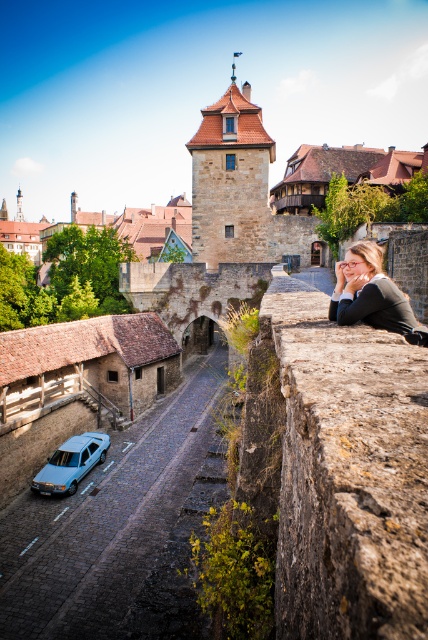
Question: Which object is farther from the camera taking this photo?

Choices:
 (A) matte black sweater at center
 (B) light blue matte sedan at lower left
 (C) rusty stone ledge at right

Answer: (B)

Question: Is rusty stone ledge at right to the left of light blue matte sedan at lower left from the viewer's perspective?

Choices:
 (A) no
 (B) yes

Answer: (A)

Question: Which point is closer to the camera?

Choices:
 (A) matte black sweater at center
 (B) rusty stone ledge at right
 (C) light blue matte sedan at lower left

Answer: (B)

Question: Among these points, which one is farthest from the camera?

Choices:
 (A) (336, 272)
 (B) (80, 444)
 (C) (285, 500)

Answer: (B)

Question: Does rusty stone ledge at right appear over light blue matte sedan at lower left?

Choices:
 (A) yes
 (B) no

Answer: (A)

Question: Is rusty stone ledge at right above matte black sweater at center?

Choices:
 (A) no
 (B) yes

Answer: (A)